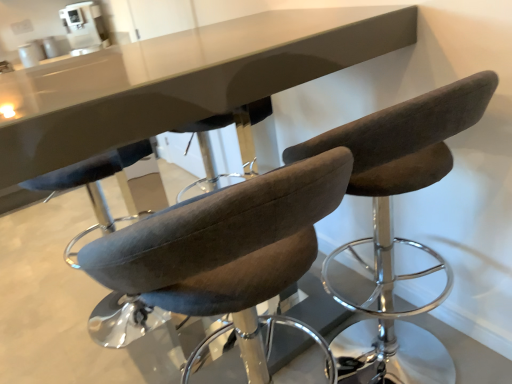
Question: Considering the positions of dark brown fabric chair at center, acting as the second chair starting from the left, and white plastic coffee machine at upper center in the image, is dark brown fabric chair at center, acting as the second chair starting from the left, bigger or smaller than white plastic coffee machine at upper center?

Choices:
 (A) big
 (B) small

Answer: (A)

Question: From a real-world perspective, is dark brown fabric chair at center, positioned as the first chair in right-to-left order, above or below white plastic coffee machine at upper center?

Choices:
 (A) below
 (B) above

Answer: (A)

Question: Which of these objects is positioned farthest from the dark brown fabric chair at center, acting as the second chair starting from the left?

Choices:
 (A) white plastic coffee machine at upper center
 (B) velvet brown stool at center, the 2th chair from the right

Answer: (A)

Question: Which of these objects is positioned farthest from the white plastic coffee machine at upper center?

Choices:
 (A) dark brown fabric chair at center, positioned as the first chair in right-to-left order
 (B) velvet brown stool at center, the 1th chair viewed from the left

Answer: (B)